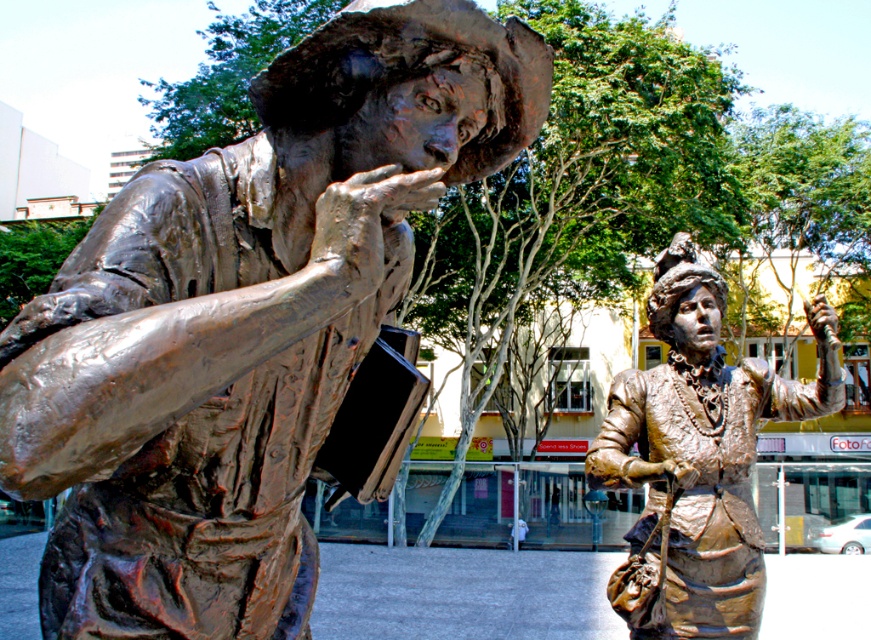
Question: Is bronze statue at left in front of bronze statue at right?

Choices:
 (A) yes
 (B) no

Answer: (A)

Question: Is bronze statue at left thinner than bronze statue at right?

Choices:
 (A) no
 (B) yes

Answer: (A)

Question: Which point is closer to the camera?

Choices:
 (A) (643, 522)
 (B) (193, 253)

Answer: (B)

Question: Does bronze statue at left have a larger size compared to bronze statue at right?

Choices:
 (A) no
 (B) yes

Answer: (B)